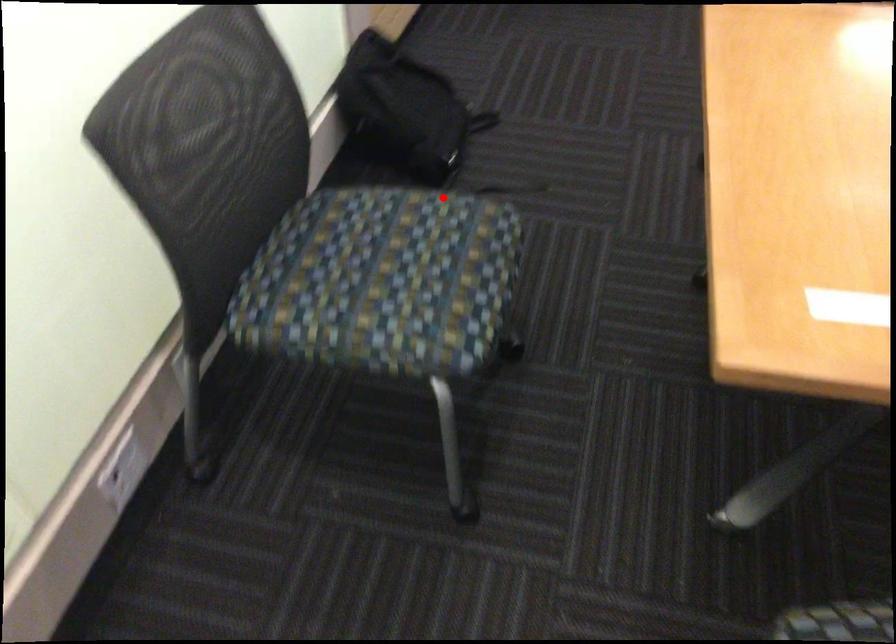
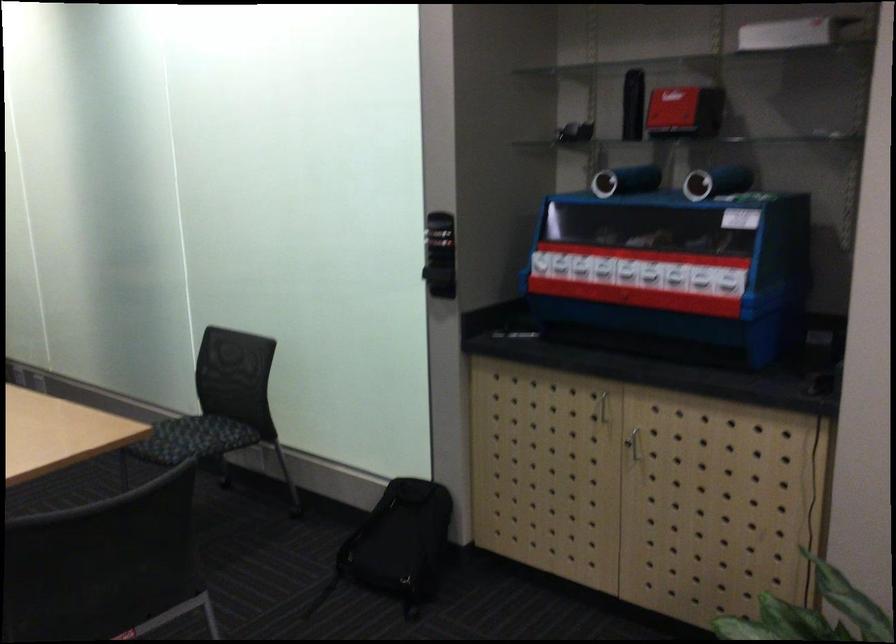
In the second image, find the point that corresponds to the highlighted location in the first image.

(194, 439)